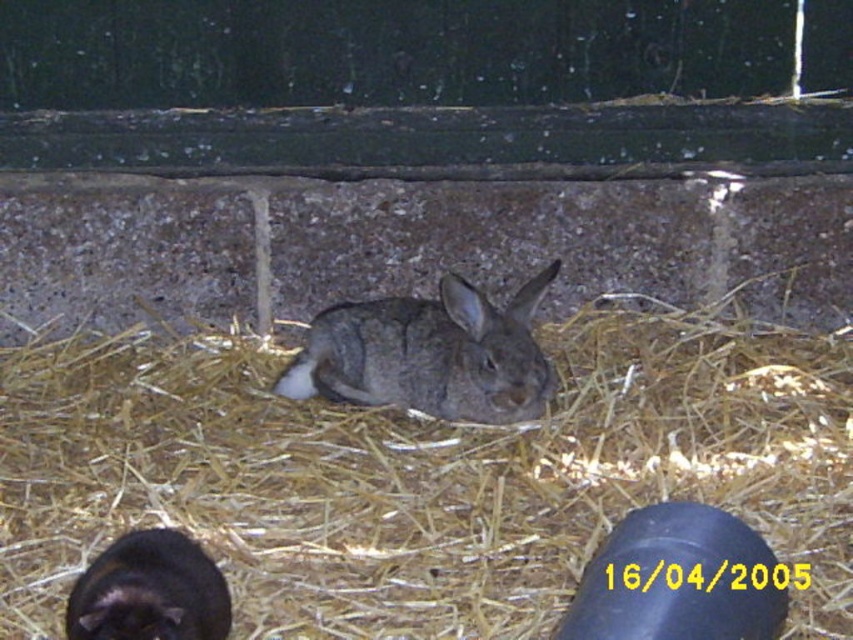
Is point (155, 467) behind point (154, 609)?

Yes.

Which is above, brown straw at center or black fur rabbit at lower left?

brown straw at center is above.

Is point (39, 380) less distant than point (135, 632)?

No, (39, 380) is behind (135, 632).

Where is `brown straw at center`? Image resolution: width=853 pixels, height=640 pixels. brown straw at center is located at coordinates (419, 476).

Is fuzzy gray rabbit at center shorter than black fur rabbit at lower left?

Incorrect, fuzzy gray rabbit at center's height does not fall short of black fur rabbit at lower left's.

Who is taller, fuzzy gray rabbit at center or black fur rabbit at lower left?

fuzzy gray rabbit at center is taller.

What do you see at coordinates (428, 355) in the screenshot? I see `fuzzy gray rabbit at center` at bounding box center [428, 355].

Where is `fuzzy gray rabbit at center`? This screenshot has height=640, width=853. fuzzy gray rabbit at center is located at coordinates (428, 355).

Is point (622, 406) more distant than point (473, 369)?

Yes, point (622, 406) is behind point (473, 369).

Image resolution: width=853 pixels, height=640 pixels. In order to click on brown straw at center in this screenshot , I will do `click(419, 476)`.